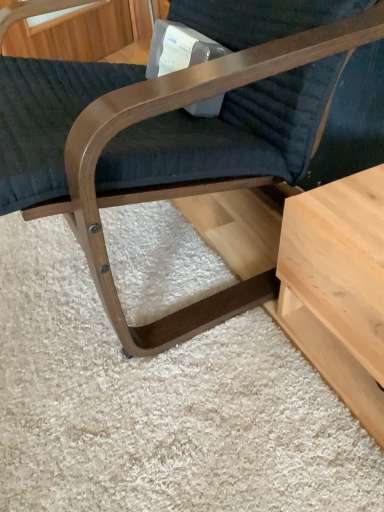
In order to face wooden chair at center, should I rotate leftwards or rightwards?

It's best to rotate left around 4.137 degrees.

The height and width of the screenshot is (512, 384). What are the coordinates of `wooden chair at center` in the screenshot? It's located at (169, 135).

Describe the element at coordinates (169, 135) in the screenshot. I see `wooden chair at center` at that location.

The height and width of the screenshot is (512, 384). I want to click on wooden chair at center, so click(x=169, y=135).